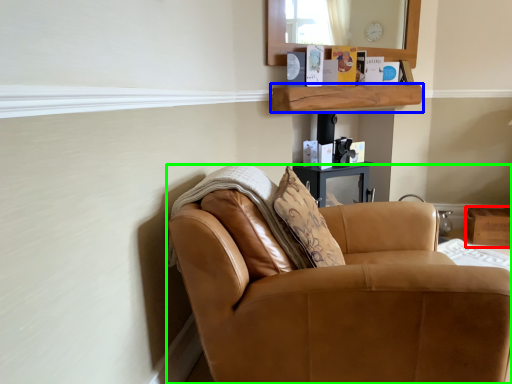
Question: Which is farther away from box (highlighted by a red box)? shelf (highlighted by a blue box) or chair (highlighted by a green box)?

Choices:
 (A) shelf
 (B) chair

Answer: (B)